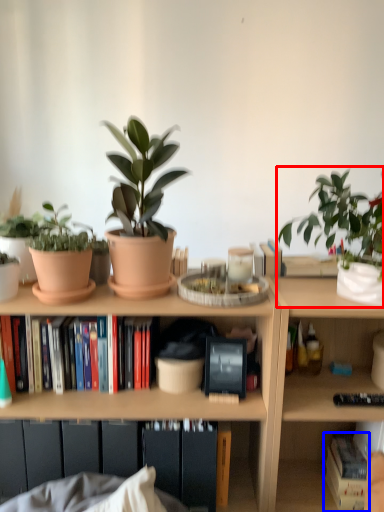
Question: Among these objects, which one is farthest to the camera, houseplant (highlighted by a red box) or book (highlighted by a blue box)?

Choices:
 (A) houseplant
 (B) book

Answer: (A)